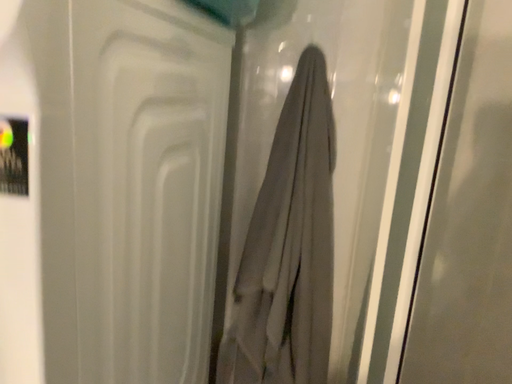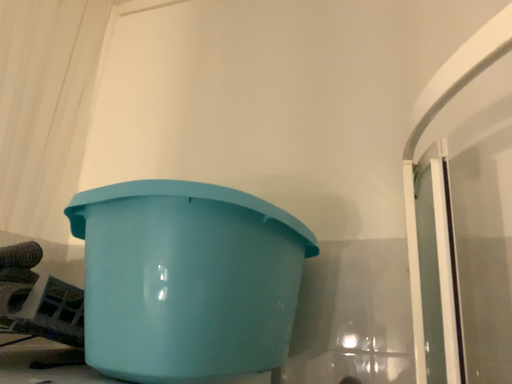
Question: Which way did the camera rotate in the video?

Choices:
 (A) rotated left
 (B) rotated right

Answer: (A)